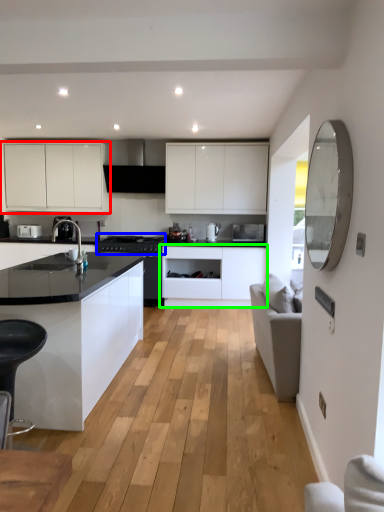
Question: Which object is the closest to the cabinetry (highlighted by a red box)? Choose among these: appliance (highlighted by a blue box) or cabinetry (highlighted by a green box).

Choices:
 (A) appliance
 (B) cabinetry

Answer: (A)